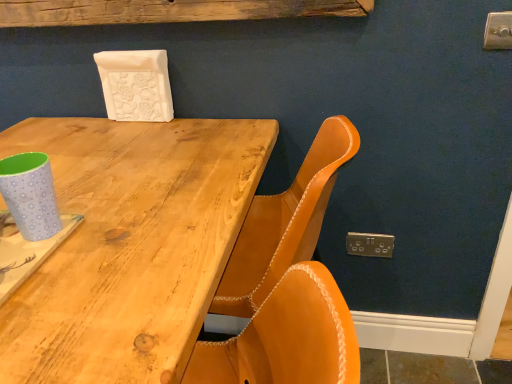
This screenshot has height=384, width=512. Describe the element at coordinates (30, 195) in the screenshot. I see `light blue polka dot paper cup at left` at that location.

Where is `gold metallic electric outlet at lower right`? gold metallic electric outlet at lower right is located at coordinates (370, 244).

Considering the relative sizes of natural wood table at center and rustic wood plank at upper center in the image provided, is natural wood table at center bigger than rustic wood plank at upper center?

Correct, natural wood table at center is larger in size than rustic wood plank at upper center.

Looking at this image, is natural wood table at center in contact with rustic wood plank at upper center?

natural wood table at center is not next to rustic wood plank at upper center, and they're not touching.

Does natural wood table at center have a greater width compared to rustic wood plank at upper center?

Yes, natural wood table at center is wider than rustic wood plank at upper center.

Is point (30, 233) closer or farther from the camera than point (298, 6)?

Point (30, 233) is positioned closer to the camera compared to point (298, 6).

Is light blue polka dot paper cup at left directly adjacent to rustic wood plank at upper center?

No, light blue polka dot paper cup at left is not making contact with rustic wood plank at upper center.

Which is behind, light blue polka dot paper cup at left or rustic wood plank at upper center?

rustic wood plank at upper center is behind.

Which is more to the right, light blue polka dot paper cup at left or gold metallic electric outlet at lower right?

From the viewer's perspective, gold metallic electric outlet at lower right appears more on the right side.

Could you tell me if light blue polka dot paper cup at left is facing gold metallic electric outlet at lower right?

No.

Are light blue polka dot paper cup at left and gold metallic electric outlet at lower right located far from each other?

That's not correct — light blue polka dot paper cup at left is a little close to gold metallic electric outlet at lower right.

Can we say natural wood table at center lies outside light blue polka dot paper cup at left?

Yes, natural wood table at center is outside of light blue polka dot paper cup at left.

Can you confirm if natural wood table at center is smaller than light blue polka dot paper cup at left?

Incorrect, natural wood table at center is not smaller in size than light blue polka dot paper cup at left.

Does natural wood table at center lie in front of light blue polka dot paper cup at left?

Yes, natural wood table at center is in front of light blue polka dot paper cup at left.

In terms of width, does gold metallic electric outlet at lower right look wider or thinner when compared to rustic wood plank at upper center?

Clearly, gold metallic electric outlet at lower right has less width compared to rustic wood plank at upper center.

Is gold metallic electric outlet at lower right smaller than rustic wood plank at upper center?

Correct, gold metallic electric outlet at lower right occupies less space than rustic wood plank at upper center.

Measure the distance from gold metallic electric outlet at lower right to rustic wood plank at upper center.

They are 83.57 centimeters apart.

Is rustic wood plank at upper center at the back of gold metallic electric outlet at lower right?

No, gold metallic electric outlet at lower right is not facing the opposite direction of rustic wood plank at upper center.

How many degrees apart are the facing directions of rustic wood plank at upper center and gold metallic electric outlet at lower right?

The facing directions of rustic wood plank at upper center and gold metallic electric outlet at lower right are 0.785 degrees apart.

Does rustic wood plank at upper center have a greater height compared to gold metallic electric outlet at lower right?

No, rustic wood plank at upper center is not taller than gold metallic electric outlet at lower right.

Considering the relative sizes of rustic wood plank at upper center and gold metallic electric outlet at lower right in the image provided, is rustic wood plank at upper center wider than gold metallic electric outlet at lower right?

Yes.

From the image's perspective, is rustic wood plank at upper center under gold metallic electric outlet at lower right?

No, from the image's perspective, rustic wood plank at upper center is not beneath gold metallic electric outlet at lower right.

Does point (94, 3) lie in front of point (41, 206)?

That is False.

Is rustic wood plank at upper center positioned with its back to light blue polka dot paper cup at left?

No, rustic wood plank at upper center's orientation is not away from light blue polka dot paper cup at left.

From a real-world perspective, which is physically above, rustic wood plank at upper center or light blue polka dot paper cup at left?

In real-world perspective, rustic wood plank at upper center is above.

Does rustic wood plank at upper center have a smaller size compared to light blue polka dot paper cup at left?

No.

Where is `table below the rustic wood plank at upper center (from the image's perspective)`? table below the rustic wood plank at upper center (from the image's perspective) is located at coordinates (130, 245).

This screenshot has height=384, width=512. Find the location of `paper cup below the rustic wood plank at upper center (from a real-world perspective)`. paper cup below the rustic wood plank at upper center (from a real-world perspective) is located at coordinates (30, 195).

Which object lies further to the anchor point rustic wood plank at upper center, light blue polka dot paper cup at left or natural wood table at center?

light blue polka dot paper cup at left is further to rustic wood plank at upper center.

From the image, which object appears to be farther from light blue polka dot paper cup at left, rustic wood plank at upper center or natural wood table at center?

Among the two, rustic wood plank at upper center is located further to light blue polka dot paper cup at left.

Looking at the image, which one is located closer to rustic wood plank at upper center, natural wood table at center or gold metallic electric outlet at lower right?

natural wood table at center is positioned closer to the anchor rustic wood plank at upper center.

Based on their spatial positions, is gold metallic electric outlet at lower right or light blue polka dot paper cup at left closer to natural wood table at center?

light blue polka dot paper cup at left is closer to natural wood table at center.

Looking at the image, which one is located closer to natural wood table at center, gold metallic electric outlet at lower right or rustic wood plank at upper center?

Among the two, rustic wood plank at upper center is located nearer to natural wood table at center.

Considering their positions, is rustic wood plank at upper center positioned further to light blue polka dot paper cup at left than gold metallic electric outlet at lower right?

gold metallic electric outlet at lower right is positioned further to the anchor light blue polka dot paper cup at left.

Looking at the image, which one is located closer to gold metallic electric outlet at lower right, rustic wood plank at upper center or light blue polka dot paper cup at left?

rustic wood plank at upper center lies closer to gold metallic electric outlet at lower right than the other object.

Which object lies further to the anchor point gold metallic electric outlet at lower right, light blue polka dot paper cup at left or rustic wood plank at upper center?

light blue polka dot paper cup at left lies further to gold metallic electric outlet at lower right than the other object.

Identify the location of plank between light blue polka dot paper cup at left and gold metallic electric outlet at lower right. The image size is (512, 384). (168, 11).

Find the location of a particular element. paper cup that lies between rustic wood plank at upper center and natural wood table at center from top to bottom is located at coordinates (30, 195).

This screenshot has width=512, height=384. What are the coordinates of `paper cup positioned between natural wood table at center and gold metallic electric outlet at lower right from near to far` in the screenshot? It's located at (30, 195).

Find the location of `plank between natural wood table at center and gold metallic electric outlet at lower right from front to back`. plank between natural wood table at center and gold metallic electric outlet at lower right from front to back is located at coordinates (168, 11).